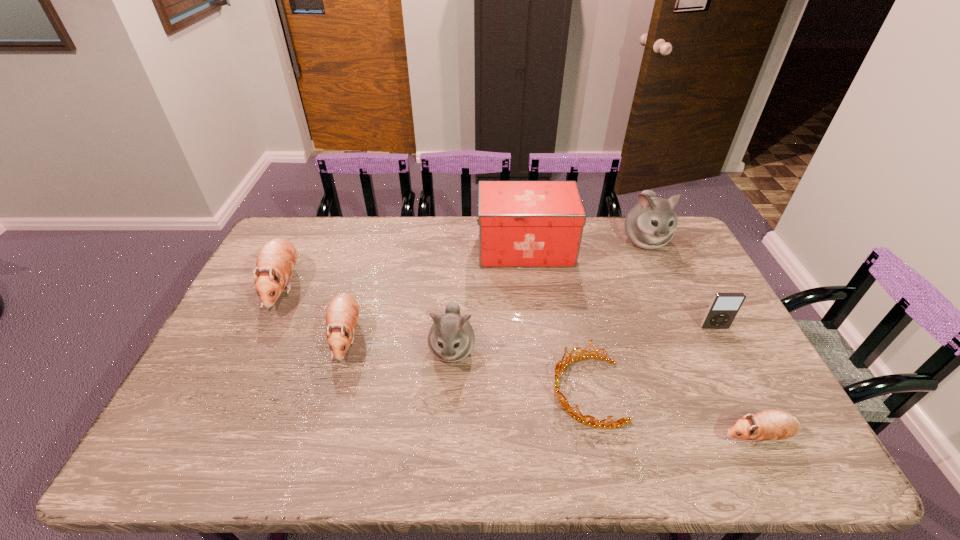
This screenshot has height=540, width=960. Find the location of `object that is the fourth closest to the leftmost brown hamster`. object that is the fourth closest to the leftmost brown hamster is located at coordinates (622, 421).

Identify which hamster is the fourth closest to the leftmost brown hamster. Please provide its 2D coordinates. Your answer should be formatted as a tuple, i.e. [(x, y)], where the tuple contains the x and y coordinates of a point satisfying the conditions above.

[(771, 424)]

Image resolution: width=960 pixels, height=540 pixels. Identify the location of hamster that is the fourth closest to the tiara. (342, 313).

Locate an element on the screen. The height and width of the screenshot is (540, 960). brown hamster that is the second closest one to the leftmost hamster is located at coordinates (771, 424).

Identify which brown hamster is the third closest to the iPod. Please provide its 2D coordinates. Your answer should be formatted as a tuple, i.e. [(x, y)], where the tuple contains the x and y coordinates of a point satisfying the conditions above.

[(276, 260)]

Identify the location of vacant space that satisfies the following two spatial constraints: 1. on the handle side of the first-aid kit; 2. at the face of the second biggest brown hamster. (537, 336).